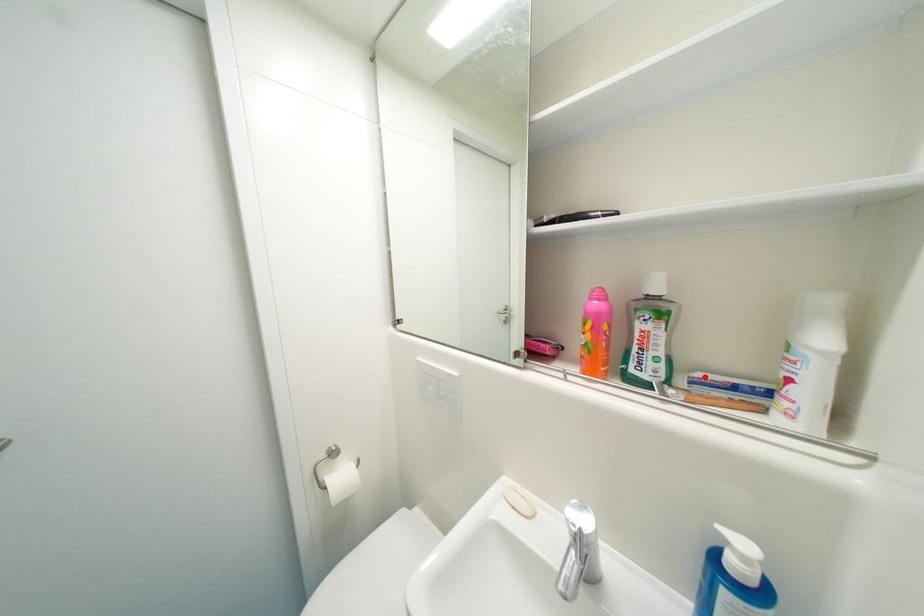
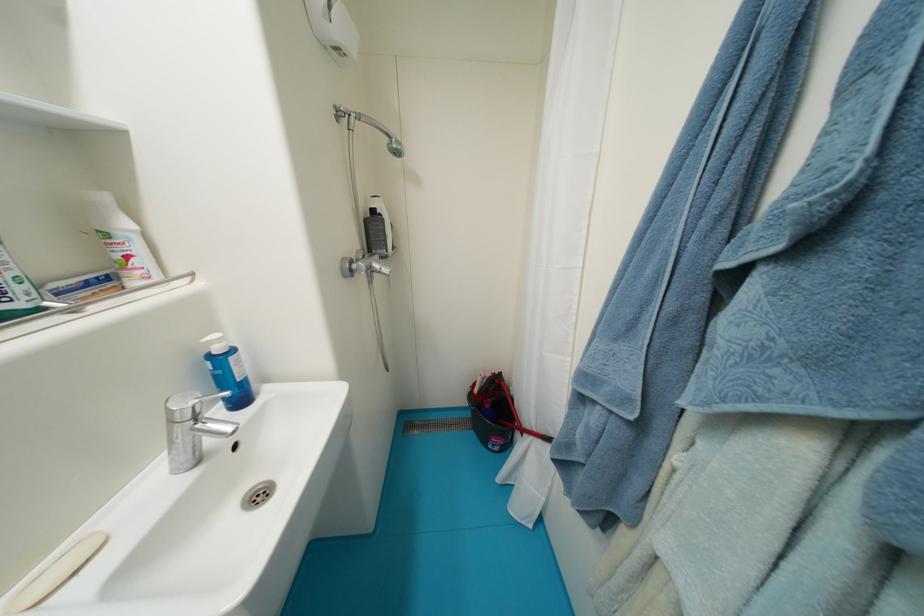
In the second image, find the point that corresponds to the highlighted location in the first image.

(61, 286)